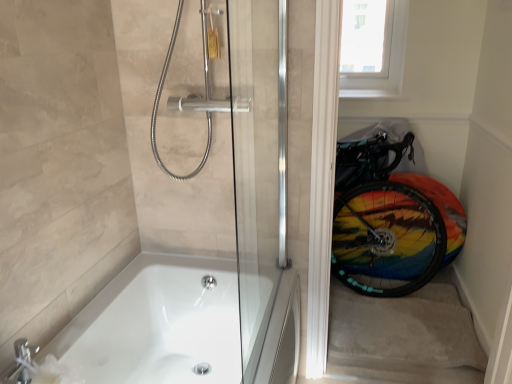
Question: Considering the positions of point (386, 23) and point (445, 283), is point (386, 23) closer or farther from the camera than point (445, 283)?

Choices:
 (A) farther
 (B) closer

Answer: (A)

Question: Choose the correct answer: Is white plastic window screen at upper right inside carpeted stairwell at lower right or outside it?

Choices:
 (A) outside
 (B) inside

Answer: (A)

Question: Estimate the real-world distances between objects in this image. Which object is closer to the rainbow painted tire at lower right?

Choices:
 (A) white plastic window screen at upper right
 (B) white glossy bathtub at lower left
 (C) transparent glass door at right
 (D) carpeted stairwell at lower right

Answer: (D)

Question: Considering the real-world distances, which object is farthest from the white plastic window screen at upper right?

Choices:
 (A) white glossy bathtub at lower left
 (B) carpeted stairwell at lower right
 (C) rainbow painted tire at lower right
 (D) transparent glass door at right

Answer: (A)